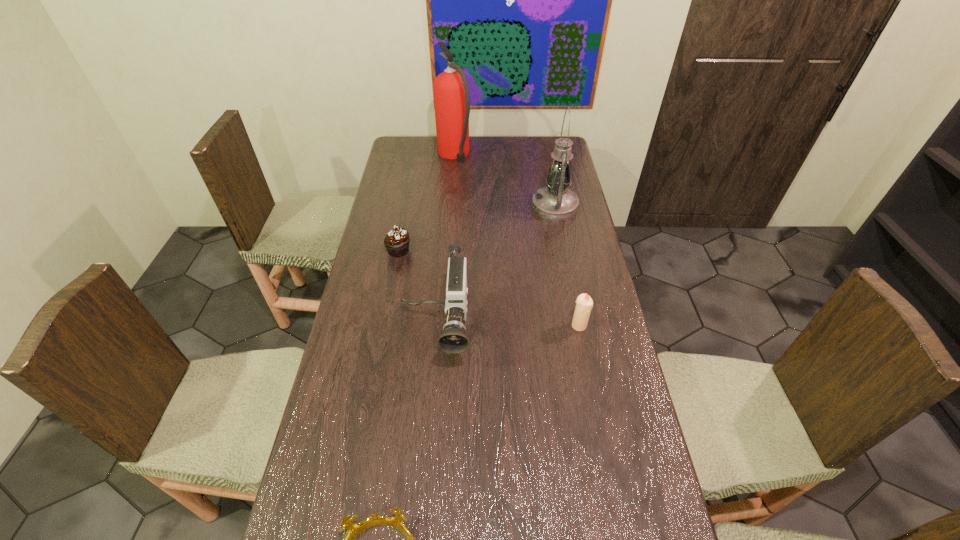
You are a GUI agent. You are given a task and a screenshot of the screen. Output one action in this format:
    pyautogui.click(x=<x>, y=<y>)
    Task: Click on the empty space that is in between the camcorder and the third shortest object
    The height and width of the screenshot is (540, 960).
    Given the screenshot: What is the action you would take?
    pyautogui.click(x=507, y=330)

The width and height of the screenshot is (960, 540). I want to click on free space between the second farthest object and the third shortest object, so click(x=566, y=266).

At what (x,y) coordinates should I click in order to perform the action: click on empty space that is in between the third shortest object and the third tallest object. Please return your answer as a coordinate pair (x, y). This screenshot has width=960, height=540. Looking at the image, I should click on (507, 330).

Find the location of a particular element. Image resolution: width=960 pixels, height=540 pixels. free area in between the camcorder and the candle is located at coordinates (507, 330).

This screenshot has width=960, height=540. I want to click on vacant area that lies between the second shortest object and the fire extinguisher, so click(x=426, y=203).

At what (x,y) coordinates should I click in order to perform the action: click on the closest object to the second farthest object. Please return your answer as a coordinate pair (x, y). Looking at the image, I should click on (451, 92).

Where is `object that can be found as the third closest to the oil lamp`? object that can be found as the third closest to the oil lamp is located at coordinates (396, 241).